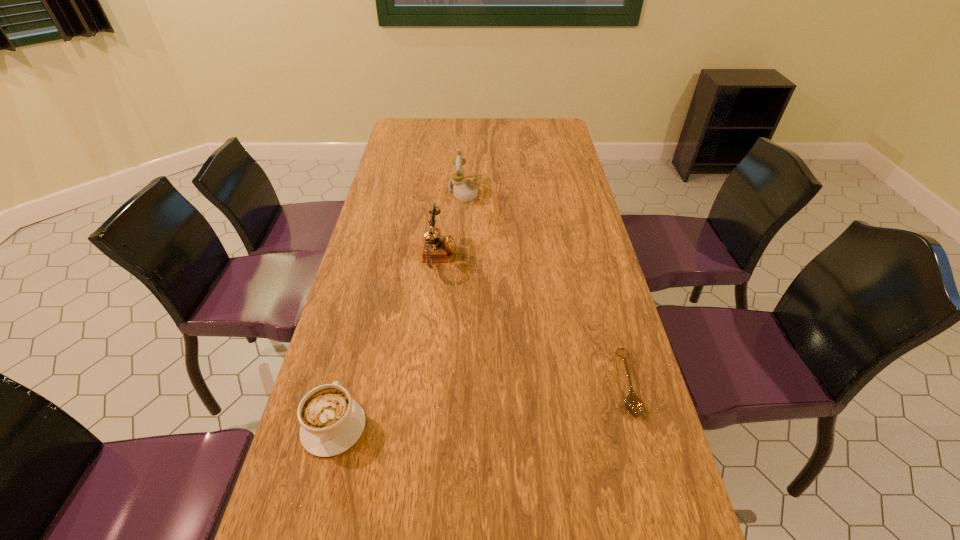
This screenshot has height=540, width=960. In order to click on vacant area in the image that satisfies the following two spatial constraints: 1. on the dial number of the rightmost object; 2. on the right side of the second farthest object in this screenshot , I will do `click(427, 383)`.

Where is `free space that satisfies the following two spatial constraints: 1. to the right of the rightmost object's handle; 2. on the left side of the leftmost object`? The width and height of the screenshot is (960, 540). free space that satisfies the following two spatial constraints: 1. to the right of the rightmost object's handle; 2. on the left side of the leftmost object is located at coordinates (345, 383).

Where is `free space that satisfies the following two spatial constraints: 1. to the right of the ladle's handle; 2. on the right side of the third tallest object`? free space that satisfies the following two spatial constraints: 1. to the right of the ladle's handle; 2. on the right side of the third tallest object is located at coordinates (345, 383).

You are a GUI agent. You are given a task and a screenshot of the screen. Output one action in this format:
    pyautogui.click(x=<x>, y=<y>)
    Task: Click on the vacant space that satisfies the following two spatial constraints: 1. on the dial of the farthest object; 2. on the right side of the ladle
    The height and width of the screenshot is (540, 960).
    Given the screenshot: What is the action you would take?
    (x=453, y=383)

The image size is (960, 540). Identify the location of blank area in the image that satisfies the following two spatial constraints: 1. to the right of the ladle's handle; 2. on the left side of the leftmost object. (345, 383).

Locate an element on the screen. The height and width of the screenshot is (540, 960). free space that satisfies the following two spatial constraints: 1. to the right of the third tallest object's handle; 2. on the right side of the rightmost object is located at coordinates (345, 383).

The height and width of the screenshot is (540, 960). I want to click on free location that satisfies the following two spatial constraints: 1. on the dial number of the nearer telephone; 2. on the left side of the shortest object, so click(x=427, y=383).

You are a GUI agent. You are given a task and a screenshot of the screen. Output one action in this format:
    pyautogui.click(x=<x>, y=<y>)
    Task: Click on the free space that satisfies the following two spatial constraints: 1. on the dial of the farthest object; 2. on the back side of the shortest object
    
    Given the screenshot: What is the action you would take?
    pyautogui.click(x=453, y=383)

You are a GUI agent. You are given a task and a screenshot of the screen. Output one action in this format:
    pyautogui.click(x=<x>, y=<y>)
    Task: Click on the vacant region that satisfies the following two spatial constraints: 1. to the right of the rightmost object's handle; 2. on the left side of the cappuccino
    
    Given the screenshot: What is the action you would take?
    pyautogui.click(x=345, y=383)

Where is `vacant space that satisfies the following two spatial constraints: 1. to the right of the leftmost object's handle; 2. on the left side of the shortest object`? vacant space that satisfies the following two spatial constraints: 1. to the right of the leftmost object's handle; 2. on the left side of the shortest object is located at coordinates (345, 383).